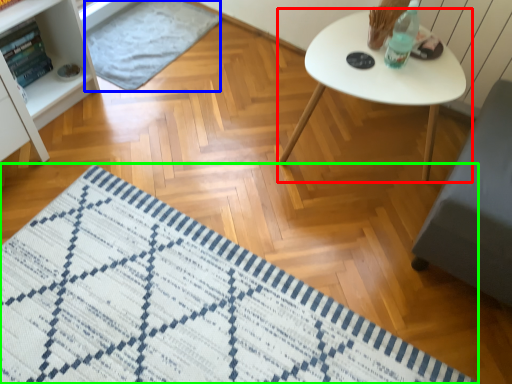
Question: Considering the real-world distances, which object is closest to table (highlighted by a red box)? mat (highlighted by a blue box) or mat (highlighted by a green box).

Choices:
 (A) mat
 (B) mat

Answer: (B)